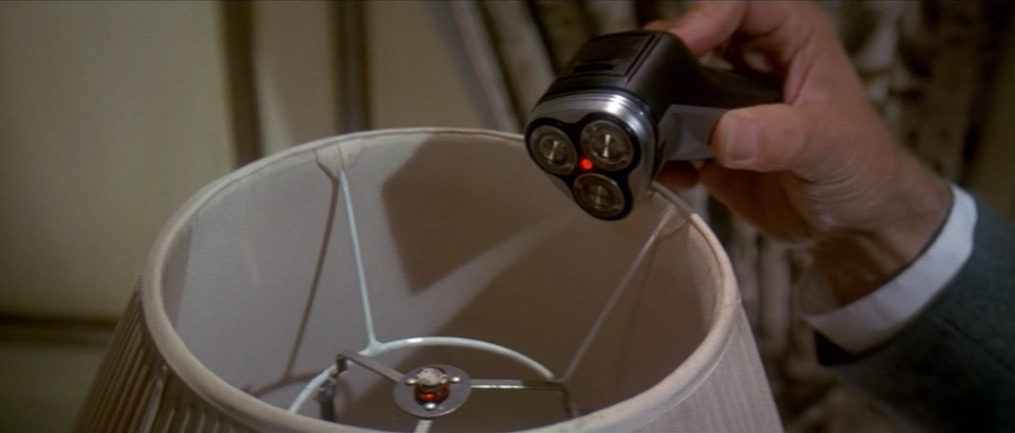
You are a GUI agent. You are given a task and a screenshot of the screen. Output one action in this format:
    pyautogui.click(x=<x>, y=<y>)
    Task: Click on the lamp shade
    
    Given the screenshot: What is the action you would take?
    click(x=718, y=329)